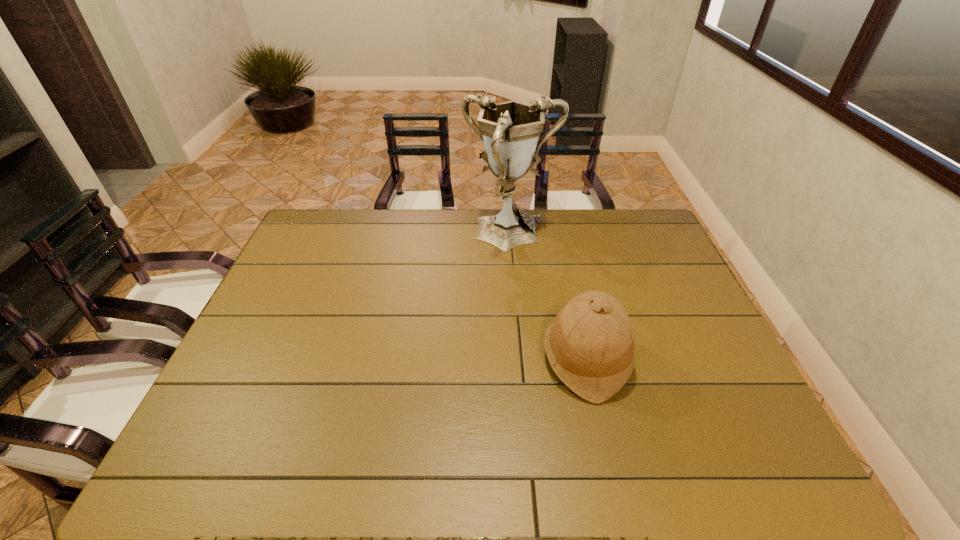
The height and width of the screenshot is (540, 960). I want to click on the farther object, so point(509,131).

This screenshot has width=960, height=540. I want to click on the taller object, so click(x=509, y=131).

The width and height of the screenshot is (960, 540). In order to click on the shorter object in this screenshot , I will do `click(590, 345)`.

Locate an element on the screen. Image resolution: width=960 pixels, height=540 pixels. the nearer object is located at coordinates (590, 345).

The image size is (960, 540). What are the coordinates of `vacant space located on the left of the trophy cup` in the screenshot? It's located at (420, 235).

Where is `vacant space located 0.350m on the front-facing side of the hat`? This screenshot has width=960, height=540. vacant space located 0.350m on the front-facing side of the hat is located at coordinates (408, 357).

Find the location of `vacant space located on the front-facing side of the hat`. vacant space located on the front-facing side of the hat is located at coordinates (450, 357).

This screenshot has width=960, height=540. Identify the location of vacant space situated 0.320m on the front-facing side of the hat. (420, 357).

You are a GUI agent. You are given a task and a screenshot of the screen. Output one action in this format:
    pyautogui.click(x=<x>, y=<y>)
    Task: Click on the object at the far edge
    
    Given the screenshot: What is the action you would take?
    pyautogui.click(x=509, y=131)

I want to click on vacant space at the far edge of the desktop, so click(442, 221).